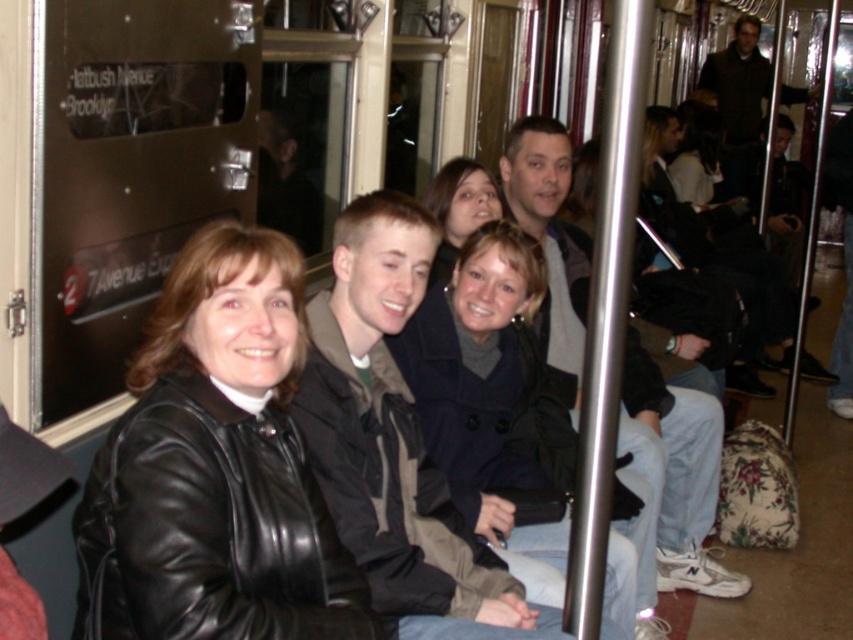
Is point (144, 372) closer to camera compared to point (810, 90)?

That is True.

Measure the distance between point (201, 435) and camera.

A distance of 4.86 feet exists between point (201, 435) and camera.

Is point (265, 323) more distant than point (769, 68)?

No, it is in front of (769, 68).

Where is `black leather jacket at center`? This screenshot has height=640, width=853. black leather jacket at center is located at coordinates (215, 468).

Does light gray fabric jacket at center appear on the right side of matte black coat at center?

Yes, light gray fabric jacket at center is to the right of matte black coat at center.

Between light gray fabric jacket at center and matte black coat at center, which one appears on the left side from the viewer's perspective?

From the viewer's perspective, matte black coat at center appears more on the left side.

Is point (724, 573) farther from camera compared to point (453, 252)?

That is True.

The image size is (853, 640). I want to click on light gray fabric jacket at center, so click(672, 477).

Can you confirm if dark blue coat at center is smaller than light gray fabric jacket at center?

Yes.

Who is taller, dark blue coat at center or light gray fabric jacket at center?

light gray fabric jacket at center is taller.

Who is more distant from viewer, (541, 262) or (572, 317)?

Positioned behind is point (572, 317).

Locate an element on the screen. The width and height of the screenshot is (853, 640). dark blue coat at center is located at coordinates (480, 384).